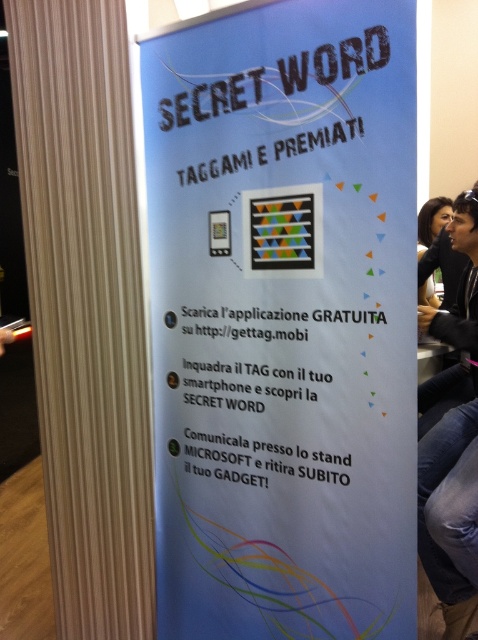
Question: Which is nearer to the blue paper poster at center?

Choices:
 (A) matte black hair at upper right
 (B) dark hair at upper right

Answer: (B)

Question: Is blue paper poster at center above matte black hair at upper right?

Choices:
 (A) no
 (B) yes

Answer: (A)

Question: Among these objects, which one is nearest to the camera?

Choices:
 (A) matte black hair at upper right
 (B) blue paper poster at center

Answer: (B)

Question: Is blue paper poster at center closer to camera compared to matte black hair at upper right?

Choices:
 (A) yes
 (B) no

Answer: (A)

Question: Which point is closer to the camera taking this photo?

Choices:
 (A) (444, 273)
 (B) (420, 285)

Answer: (B)

Question: In this image, where is blue paper poster at center located relative to matte black hair at upper right?

Choices:
 (A) below
 (B) above

Answer: (A)